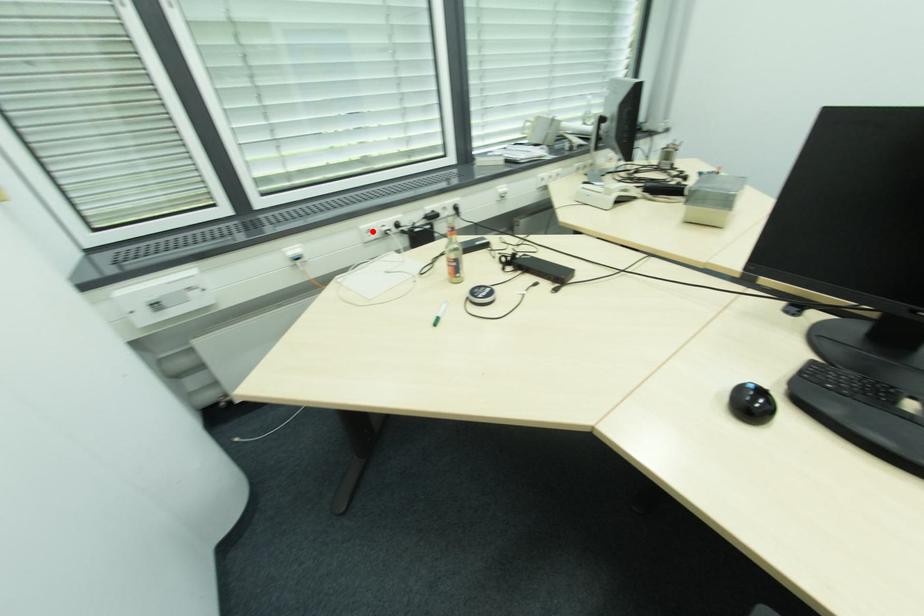
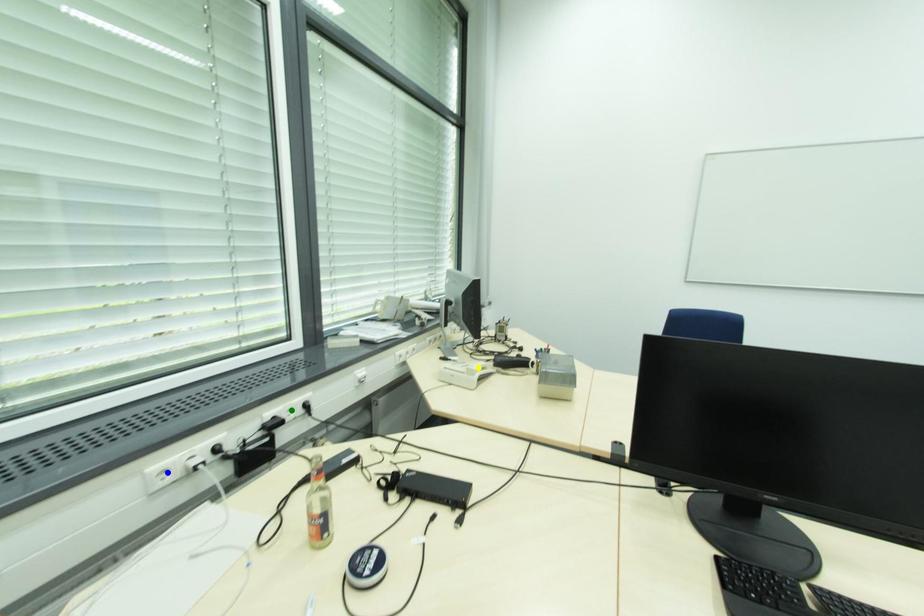
Question: I am providing you with two images of the same scene from different viewpoints. A red point is marked on the first image. You are given multiple points on the second image. In image 2, which mark is for the same physical point as the one in image 1?

Choices:
 (A) green point
 (B) yellow point
 (C) blue point

Answer: (C)